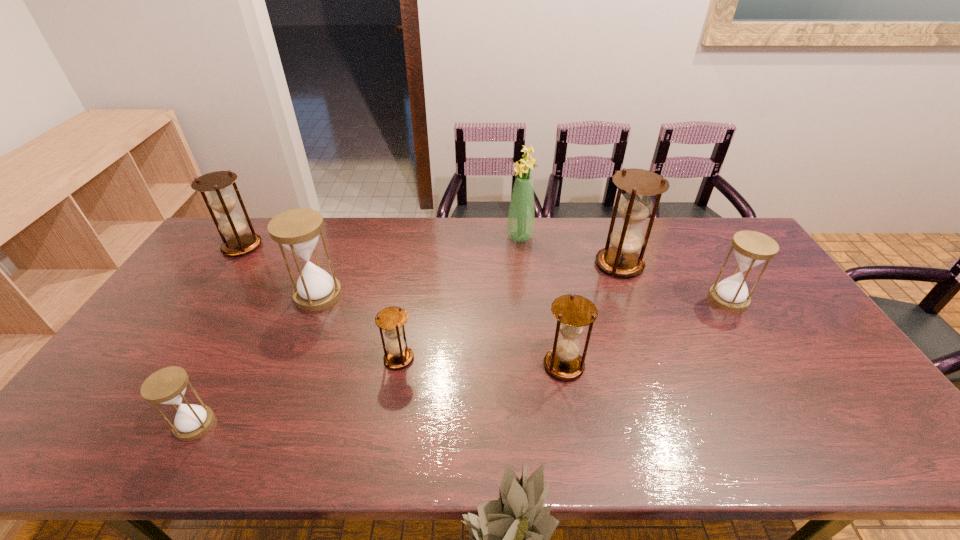
The height and width of the screenshot is (540, 960). I want to click on vacant position located on the back of the third object from left to right, so click(x=330, y=266).

Image resolution: width=960 pixels, height=540 pixels. What are the coordinates of `vacant area located on the left of the fifth hourglass from left to right` in the screenshot? It's located at (464, 366).

Locate an element on the screen. The image size is (960, 540). free space located on the back of the rightmost white hourglass is located at coordinates (709, 268).

Identify the location of free space located on the front of the fourth hourglass from right to left. (389, 415).

Where is `vacant area located 0.370m on the back of the nearest object`? vacant area located 0.370m on the back of the nearest object is located at coordinates (261, 302).

Locate an element on the screen. The width and height of the screenshot is (960, 540). bouquet situated at the far edge is located at coordinates (521, 217).

This screenshot has height=540, width=960. Find the location of `object that is at the near edge`. object that is at the near edge is located at coordinates (167, 386).

The width and height of the screenshot is (960, 540). Find the location of `object located at the left edge`. object located at the left edge is located at coordinates (233, 226).

Identify the location of object that is at the right edge. coord(751,248).

Where is `object that is at the far left corner`? Image resolution: width=960 pixels, height=540 pixels. object that is at the far left corner is located at coordinates (233, 226).